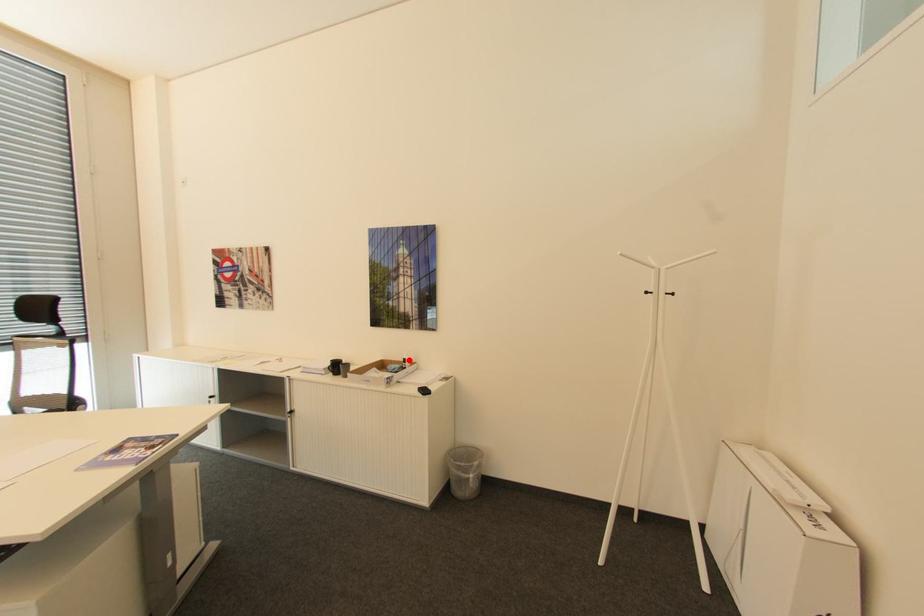
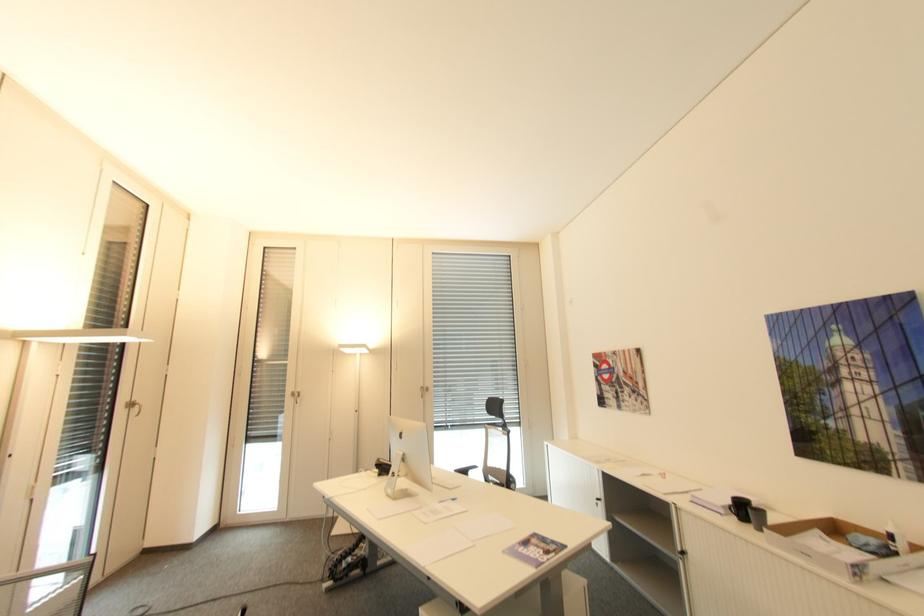
The point at the highlighted location is marked in the first image. Where is the corresponding point in the second image?

(895, 537)